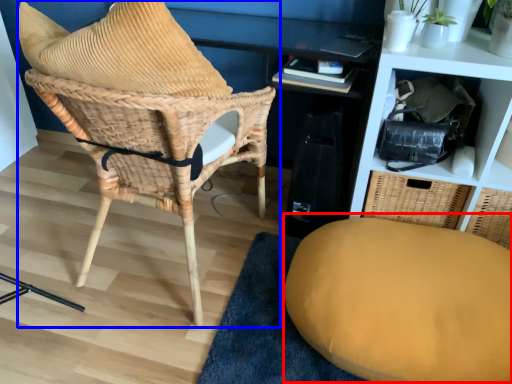
Question: Which object appears farthest to the camera in this image, swivel chair (highlighted by a red box) or chair (highlighted by a blue box)?

Choices:
 (A) swivel chair
 (B) chair

Answer: (A)